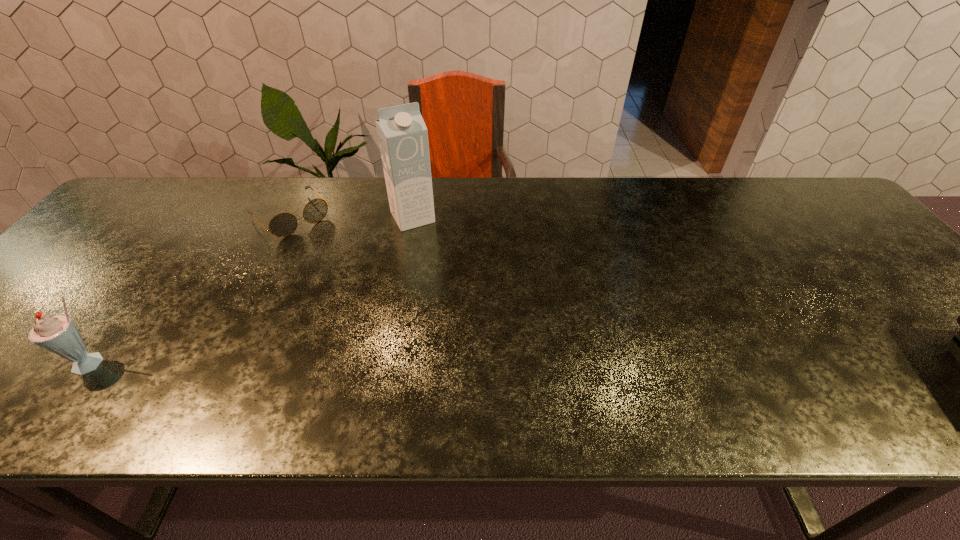
I want to click on free space located on the lenses of the shortest object, so click(358, 283).

You are a GUI agent. You are given a task and a screenshot of the screen. Output one action in this format:
    pyautogui.click(x=<x>, y=<y>)
    Task: Click on the free location located 0.160m on the lenses of the shortest object
    This screenshot has width=960, height=540.
    Given the screenshot: What is the action you would take?
    pyautogui.click(x=340, y=265)

Locate an element on the screen. The image size is (960, 540). carton at the far edge is located at coordinates (402, 134).

Where is `sunglasses at the far edge`? sunglasses at the far edge is located at coordinates (284, 224).

The height and width of the screenshot is (540, 960). Find the location of `object that is at the near edge`. object that is at the near edge is located at coordinates (58, 334).

Where is `free location at the far edge of the desktop`? free location at the far edge of the desktop is located at coordinates [732, 184].

This screenshot has height=540, width=960. Identify the location of vacant space at the near edge of the desktop. (490, 382).

This screenshot has height=540, width=960. In order to click on vacant space at the left edge of the desktop in this screenshot , I will do `click(81, 312)`.

In the image, there is a desktop. Identify the location of free space at the right edge. This screenshot has height=540, width=960. (904, 315).

Find the location of `vacant point at the near left corner`. vacant point at the near left corner is located at coordinates (39, 370).